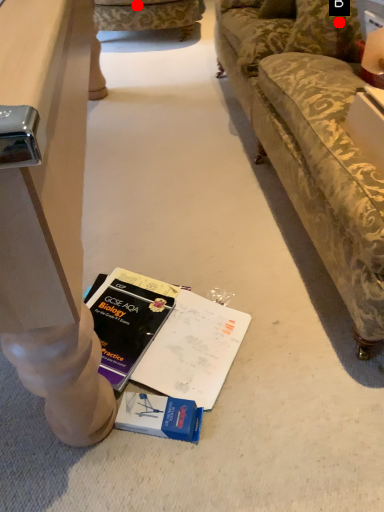
Question: Two points are circled on the image, labeled by A and B beside each circle. Which point is further to the camera?

Choices:
 (A) A is further
 (B) B is further

Answer: (A)